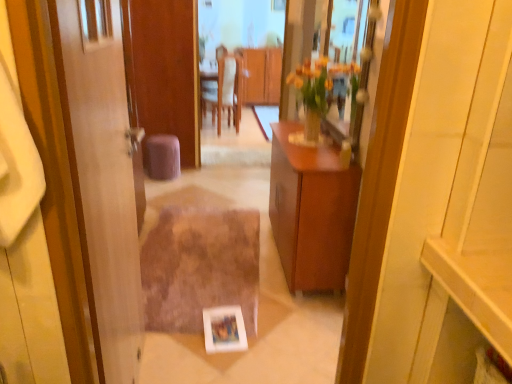
Question: Considering the relative sizes of wooden table at center, the 2th mirror viewed from the front, and wooden cabinet at center, placed as the 2th cabinetry when sorted from back to front, in the image provided, is wooden table at center, the 2th mirror viewed from the front, taller than wooden cabinet at center, placed as the 2th cabinetry when sorted from back to front,?

Choices:
 (A) yes
 (B) no

Answer: (A)

Question: Considering the relative positions of wooden table at center, the 2th mirror viewed from the front, and wooden cabinet at center, which ranks as the 2th cabinetry in top-to-bottom order, in the image provided, is wooden table at center, the 2th mirror viewed from the front, to the right of wooden cabinet at center, which ranks as the 2th cabinetry in top-to-bottom order, from the viewer's perspective?

Choices:
 (A) yes
 (B) no

Answer: (B)

Question: Can you confirm if wooden table at center, which is the 1th mirror in back-to-front order, is wider than wooden cabinet at center, the 1th cabinetry when ordered from front to back?

Choices:
 (A) no
 (B) yes

Answer: (A)

Question: Is wooden table at center, the 2th mirror positioned from the right, completely or partially outside of wooden cabinet at center, placed as the first cabinetry when sorted from bottom to top?

Choices:
 (A) no
 (B) yes

Answer: (B)

Question: Is wooden table at center, the 2th mirror viewed from the front, oriented away from wooden cabinet at center, placed as the first cabinetry when sorted from bottom to top?

Choices:
 (A) yes
 (B) no

Answer: (A)

Question: Is wooden cabinet at center, the 1th cabinetry viewed from the top, taller or shorter than wooden door at left?

Choices:
 (A) short
 (B) tall

Answer: (A)

Question: From the image's perspective, is wooden cabinet at center, the 1th cabinetry viewed from the top, positioned above or below wooden door at left?

Choices:
 (A) below
 (B) above

Answer: (B)

Question: Considering the positions of point (268, 94) and point (116, 104), is point (268, 94) closer or farther from the camera than point (116, 104)?

Choices:
 (A) closer
 (B) farther

Answer: (B)

Question: Considering their positions, is wooden cabinet at center, the 1th cabinetry viewed from the top, located in front of or behind wooden door at left?

Choices:
 (A) behind
 (B) front

Answer: (A)

Question: In the image, is wooden door at left positioned in front of or behind brown shaggy rug at center?

Choices:
 (A) front
 (B) behind

Answer: (A)

Question: From the image's perspective, is wooden door at left above or below brown shaggy rug at center?

Choices:
 (A) below
 (B) above

Answer: (B)

Question: Considering the positions of wooden door at left and brown shaggy rug at center in the image, is wooden door at left wider or thinner than brown shaggy rug at center?

Choices:
 (A) thin
 (B) wide

Answer: (A)

Question: Is point (134, 218) positioned closer to the camera than point (256, 256)?

Choices:
 (A) closer
 (B) farther

Answer: (A)

Question: In the image, is purple fabric stool at center positioned in front of or behind wooden cabinet at center, positioned as the 1th cabinetry in back-to-front order?

Choices:
 (A) behind
 (B) front

Answer: (B)

Question: Which is correct: purple fabric stool at center is inside wooden cabinet at center, the 1th cabinetry viewed from the top, or outside of it?

Choices:
 (A) inside
 (B) outside

Answer: (B)